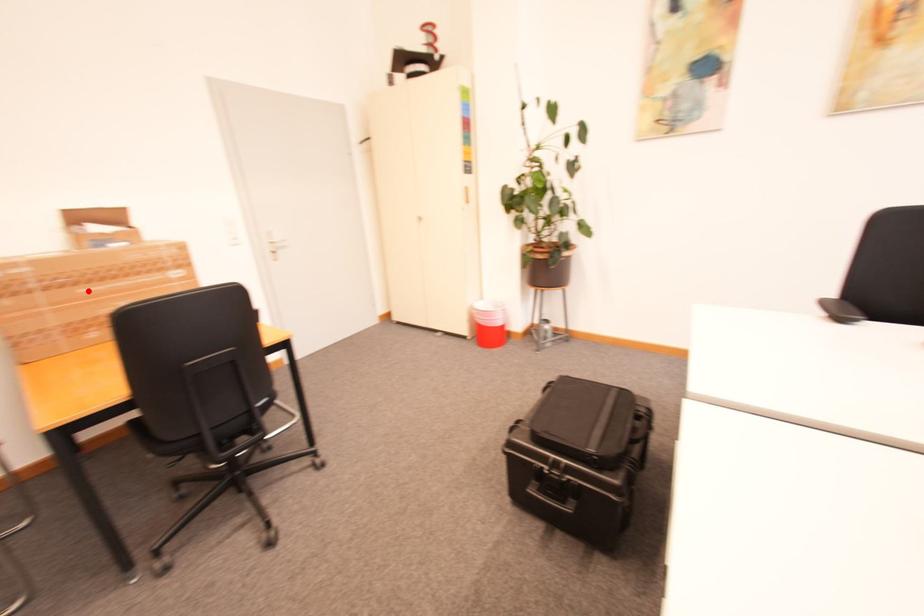
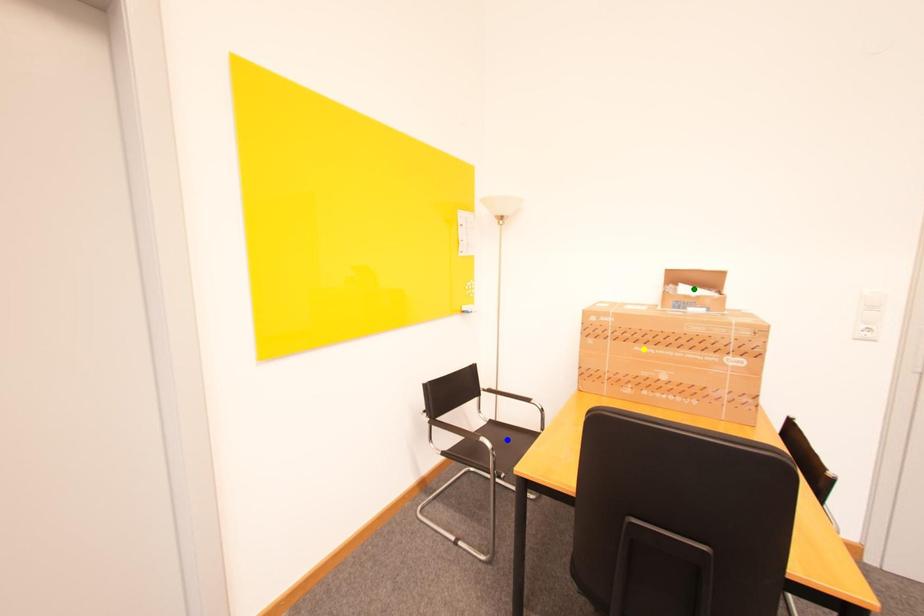
Question: I am providing you with two images of the same scene from different viewpoints. A red point is marked on the first image. You are given multiple points on the second image. Which point in image 2 is actually the same real-world point as the red point in image 1?

Choices:
 (A) blue point
 (B) green point
 (C) yellow point

Answer: (C)